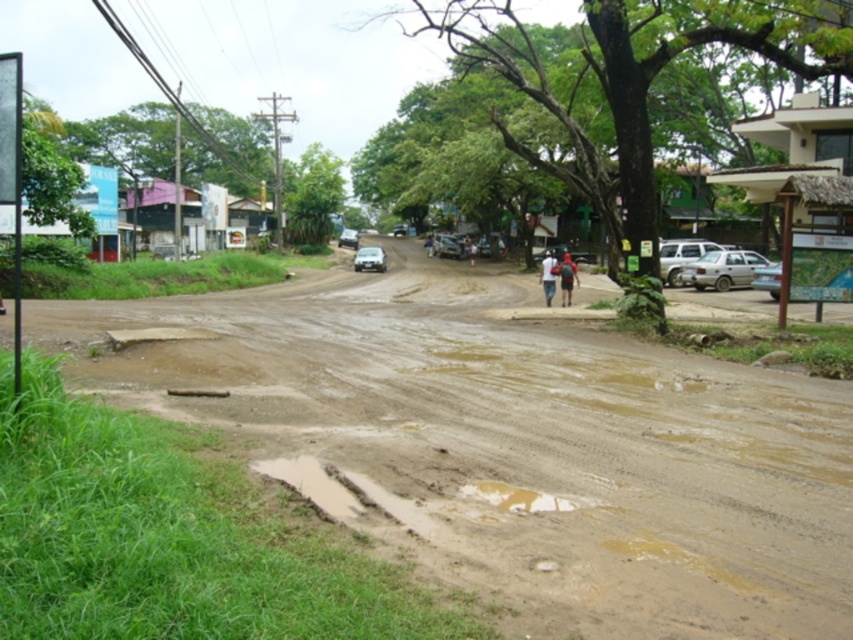
Which of these two, red fabric backpack at center or white matte shirt at center, stands shorter?

With less height is red fabric backpack at center.

Which is in front, point (563, 300) or point (546, 276)?

Positioned in front is point (546, 276).

Where is `red fabric backpack at center`? red fabric backpack at center is located at coordinates (567, 278).

From the picture: Is brown muddy road at center below red fabric backpack at center?

Yes, brown muddy road at center is below red fabric backpack at center.

Is brown muddy road at center further to camera compared to red fabric backpack at center?

No, brown muddy road at center is closer to the viewer.

This screenshot has width=853, height=640. Describe the element at coordinates (512, 445) in the screenshot. I see `brown muddy road at center` at that location.

Locate an element on the screen. The width and height of the screenshot is (853, 640). brown muddy road at center is located at coordinates pyautogui.click(x=512, y=445).

Is point (303, 456) farther from viewer compared to point (547, 257)?

That is False.

Who is taller, brown muddy road at center or white matte shirt at center?

Standing taller between the two is white matte shirt at center.

Is point (744, 490) behind point (546, 300)?

No.

I want to click on brown muddy road at center, so click(512, 445).